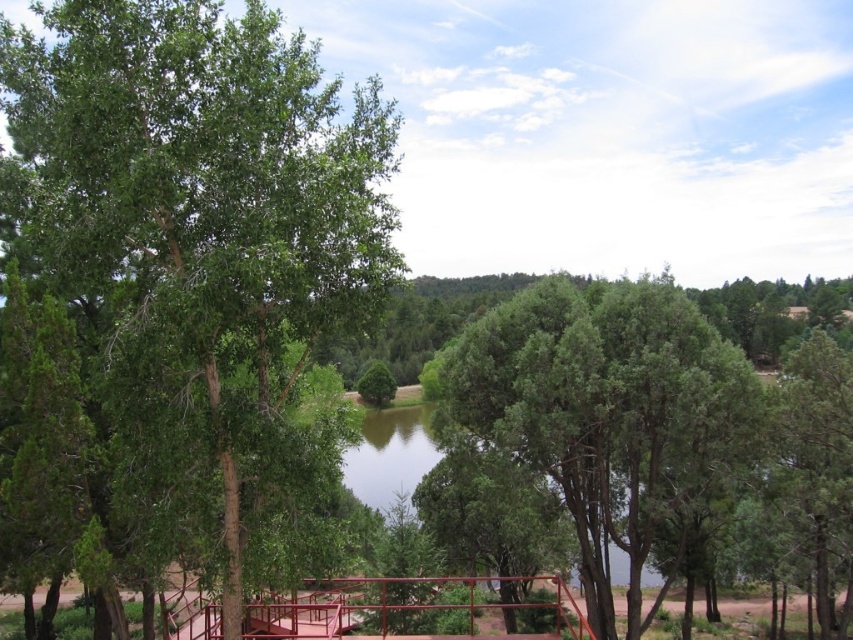
You are standing on the viewing platform and looking at the green leafy tree at left and the green textured tree at center. Which tree is higher up in the scene?

The green leafy tree at left is higher up in the scene because it is located above the green textured tree at center.

You are standing on the viewing platform and want to take a photo of two specific points in the scene. The first point is at coordinate point (308, 49) and the second is at point (579, 301). Which point is closer to you?

Point (308, 49) is closer to you because it is further to the viewer than point (579, 301).